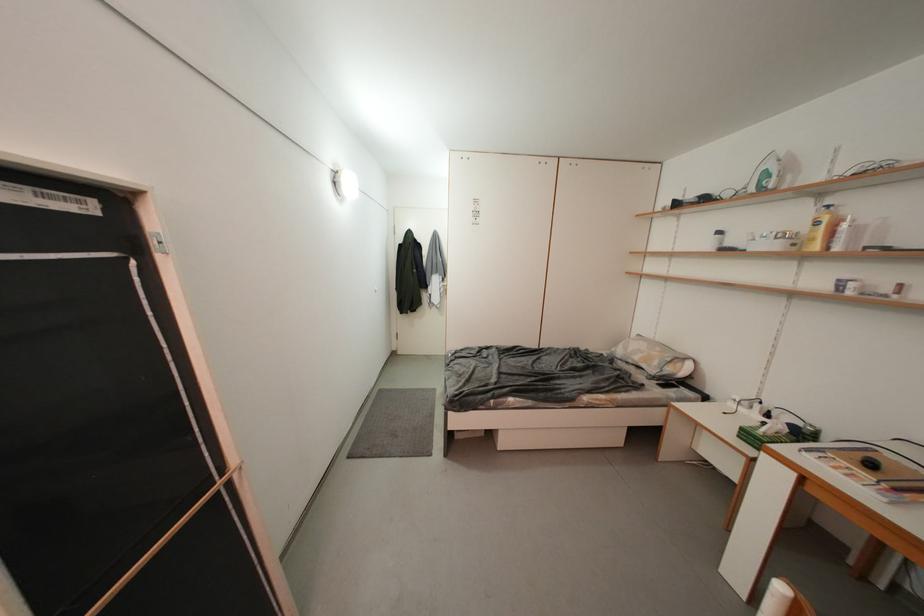
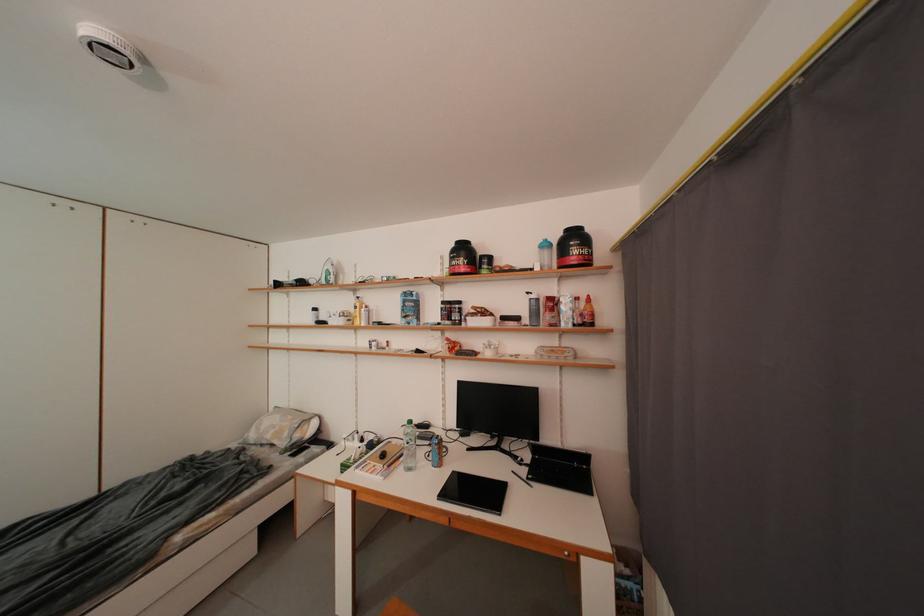
Where in the second image is the point corresponding to (x=879, y=468) from the first image?

(391, 459)